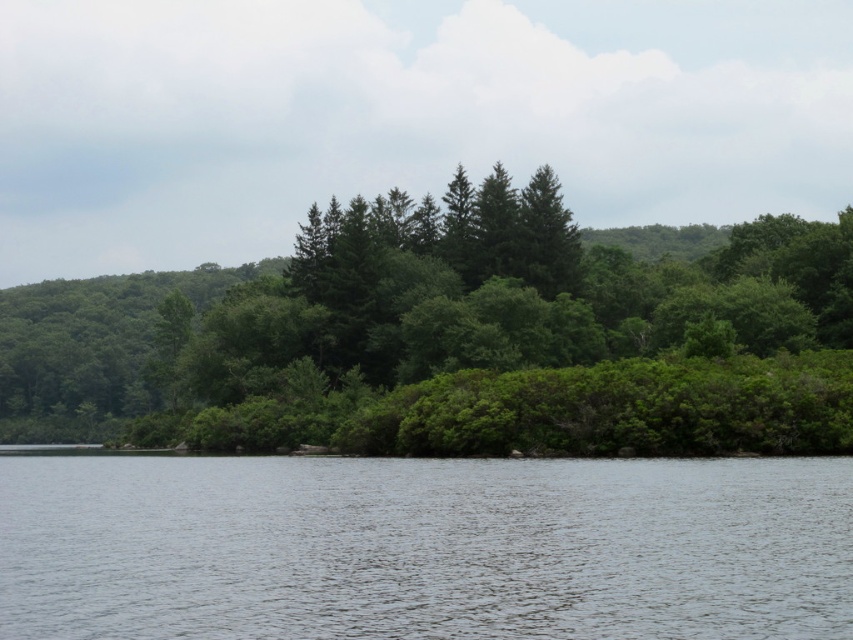
You are standing at the center of the image and notice the green leafy trees at center. Based on their position, can you determine if they are closer to the foreground or the background?

The green leafy trees at center are located at point 0.542 on the vertical axis, which places them closer to the foreground since lower values indicate proximity to the viewer.

You are standing at the edge of the water and want to see which object is higher between the green leafy trees at center and the clear water at center. According to the scene, which one is taller?

The green leafy trees at center are taller than the clear water at center.

You are standing at the point with coordinates (461, 340) in the serene natural landscape. What object is exactly at your current position?

The green leafy trees at center is located at point (461, 340), so the object exactly at your current position is the green leafy trees at center.